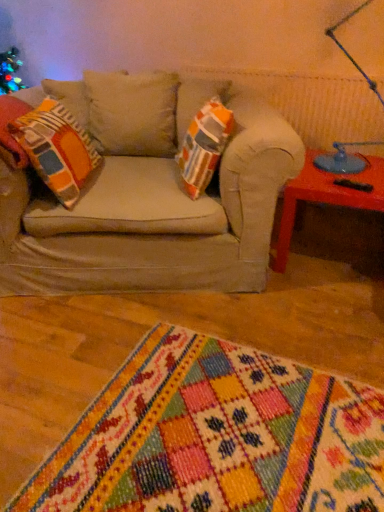
Question: Does blue glass table lamp at upper right have a lesser height compared to multicolored woven rug at lower center?

Choices:
 (A) no
 (B) yes

Answer: (A)

Question: Is multicolored woven rug at lower center located within blue glass table lamp at upper right?

Choices:
 (A) no
 (B) yes

Answer: (A)

Question: Can you confirm if blue glass table lamp at upper right is positioned to the left of multicolored woven rug at lower center?

Choices:
 (A) no
 (B) yes

Answer: (A)

Question: From the image's perspective, would you say blue glass table lamp at upper right is positioned over multicolored woven rug at lower center?

Choices:
 (A) no
 (B) yes

Answer: (B)

Question: From a real-world perspective, is blue glass table lamp at upper right located beneath multicolored woven rug at lower center?

Choices:
 (A) no
 (B) yes

Answer: (A)

Question: From a real-world perspective, is multicolored woven rug at lower center above or below blue glass table lamp at upper right?

Choices:
 (A) below
 (B) above

Answer: (A)

Question: In the image, is multicolored woven rug at lower center positioned in front of or behind blue glass table lamp at upper right?

Choices:
 (A) front
 (B) behind

Answer: (A)

Question: Considering the positions of multicolored woven rug at lower center and blue glass table lamp at upper right in the image, is multicolored woven rug at lower center wider or thinner than blue glass table lamp at upper right?

Choices:
 (A) wide
 (B) thin

Answer: (A)

Question: Is multicolored woven rug at lower center inside or outside of blue glass table lamp at upper right?

Choices:
 (A) inside
 (B) outside

Answer: (B)

Question: Would you say multicolored woven rug at lower center is to the left or to the right of orange and gray striped pillow at left in the picture?

Choices:
 (A) left
 (B) right

Answer: (B)

Question: Is point pyautogui.click(x=291, y=381) closer or farther from the camera than point pyautogui.click(x=28, y=138)?

Choices:
 (A) closer
 (B) farther

Answer: (A)

Question: Looking at the image, does multicolored woven rug at lower center seem bigger or smaller compared to orange and gray striped pillow at left?

Choices:
 (A) small
 (B) big

Answer: (B)

Question: Is multicolored woven rug at lower center inside or outside of orange and gray striped pillow at left?

Choices:
 (A) inside
 (B) outside

Answer: (B)

Question: From a real-world perspective, is blue glass table lamp at upper right above or below orange and gray striped pillow at left?

Choices:
 (A) below
 (B) above

Answer: (B)

Question: In the image, is blue glass table lamp at upper right positioned in front of or behind orange and gray striped pillow at left?

Choices:
 (A) behind
 (B) front

Answer: (A)